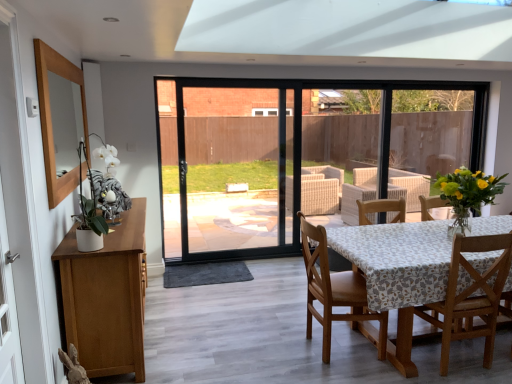
Question: Is yellow fabric vase at right, the 1th floral arrangement positioned from the back, facing away from wooden mirror at left?

Choices:
 (A) no
 (B) yes

Answer: (A)

Question: Is yellow fabric vase at right, the 1th floral arrangement positioned from the back, not inside wooden mirror at left?

Choices:
 (A) no
 (B) yes

Answer: (B)

Question: From a real-world perspective, is yellow fabric vase at right, the 2th floral arrangement positioned from the front, positioned under wooden mirror at left based on gravity?

Choices:
 (A) no
 (B) yes

Answer: (B)

Question: Does yellow fabric vase at right, the 2th floral arrangement positioned from the front, contain wooden mirror at left?

Choices:
 (A) yes
 (B) no

Answer: (B)

Question: From the image's perspective, is yellow fabric vase at right, the 2th floral arrangement positioned from the front, on wooden mirror at left?

Choices:
 (A) no
 (B) yes

Answer: (B)

Question: Is yellow fabric vase at right, the 1th floral arrangement positioned from the back, bigger than wooden mirror at left?

Choices:
 (A) yes
 (B) no

Answer: (B)

Question: Is wooden mirror at left shorter than white ceramic vase at left, which appears as the first floral arrangement when viewed from the left?

Choices:
 (A) no
 (B) yes

Answer: (A)

Question: From a real-world perspective, does wooden mirror at left sit lower than white ceramic vase at left, placed as the second floral arrangement when sorted from right to left?

Choices:
 (A) yes
 (B) no

Answer: (A)

Question: Is wooden mirror at left bigger than white ceramic vase at left, placed as the second floral arrangement when sorted from right to left?

Choices:
 (A) yes
 (B) no

Answer: (A)

Question: Is wooden mirror at left thinner than white ceramic vase at left, which appears as the first floral arrangement when viewed from the left?

Choices:
 (A) yes
 (B) no

Answer: (A)

Question: Considering the relative positions of wooden mirror at left and white ceramic vase at left, placed as the second floral arrangement when sorted from right to left, in the image provided, is wooden mirror at left in front of white ceramic vase at left, placed as the second floral arrangement when sorted from right to left,?

Choices:
 (A) no
 (B) yes

Answer: (B)

Question: Is wooden mirror at left positioned beyond the bounds of white ceramic vase at left, marked as the 2th floral arrangement in a back-to-front arrangement?

Choices:
 (A) no
 (B) yes

Answer: (B)

Question: Is white ceramic vase at left, marked as the 2th floral arrangement in a back-to-front arrangement, oriented towards wooden chair at lower right, placed as the second chair when sorted from left to right?

Choices:
 (A) no
 (B) yes

Answer: (B)